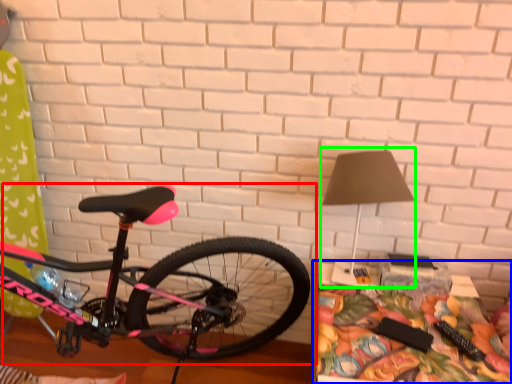
Question: Which object is the farthest from bicycle (highlighted by a red box)? Choose among these: table (highlighted by a blue box) or table lamp (highlighted by a green box).

Choices:
 (A) table
 (B) table lamp

Answer: (B)